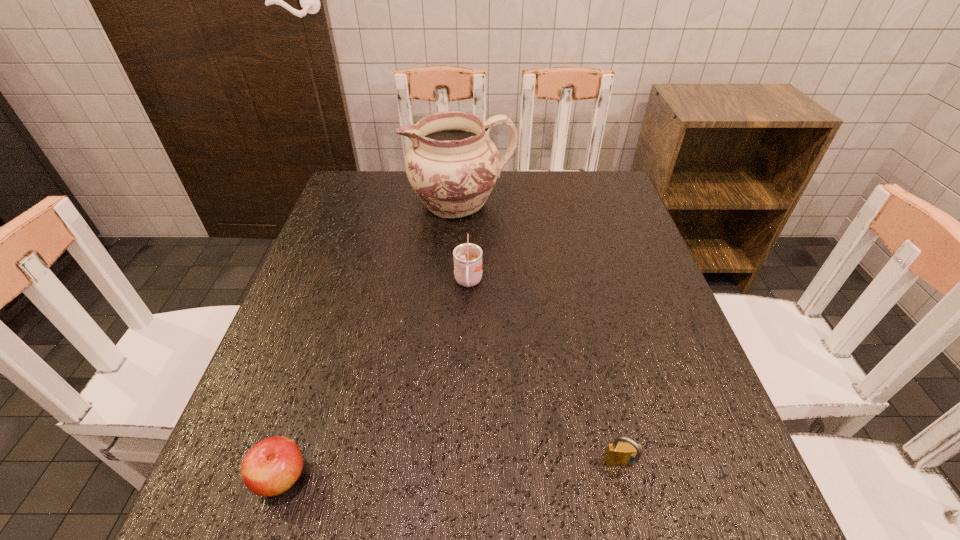
Locate an element on the screen. The image size is (960, 540). free region located on the side with the combination dials of the padlock is located at coordinates (638, 539).

Find the location of a particular element. Image resolution: width=960 pixels, height=540 pixels. vacant space situated on the back of the leftmost object is located at coordinates (324, 346).

At what (x,y) coordinates should I click in order to perform the action: click on object that is at the far edge. Please return your answer as a coordinate pair (x, y). The height and width of the screenshot is (540, 960). Looking at the image, I should click on (452, 164).

You are a GUI agent. You are given a task and a screenshot of the screen. Output one action in this format:
    pyautogui.click(x=<x>, y=<y>)
    Task: Click on the object that is at the near edge
    
    Given the screenshot: What is the action you would take?
    pyautogui.click(x=273, y=465)

You are a GUI agent. You are given a task and a screenshot of the screen. Output one action in this format:
    pyautogui.click(x=<x>, y=<y>)
    Task: Click on the object that is positioned at the left edge
    
    Given the screenshot: What is the action you would take?
    pyautogui.click(x=273, y=465)

This screenshot has width=960, height=540. In order to click on object at the near left corner in this screenshot , I will do `click(273, 465)`.

In the image, there is a desktop. At what (x,y) coordinates should I click in order to perform the action: click on vacant space at the far edge. Please return your answer as a coordinate pair (x, y). The height and width of the screenshot is (540, 960). Looking at the image, I should click on (541, 202).

Locate an element on the screen. This screenshot has width=960, height=540. blank space at the near edge is located at coordinates (417, 523).

At what (x,y) coordinates should I click in order to perform the action: click on free space at the left edge. Please return your answer as a coordinate pair (x, y). Looking at the image, I should click on (329, 334).

In the image, there is a desktop. Find the location of `free space at the right edge`. free space at the right edge is located at coordinates (663, 285).